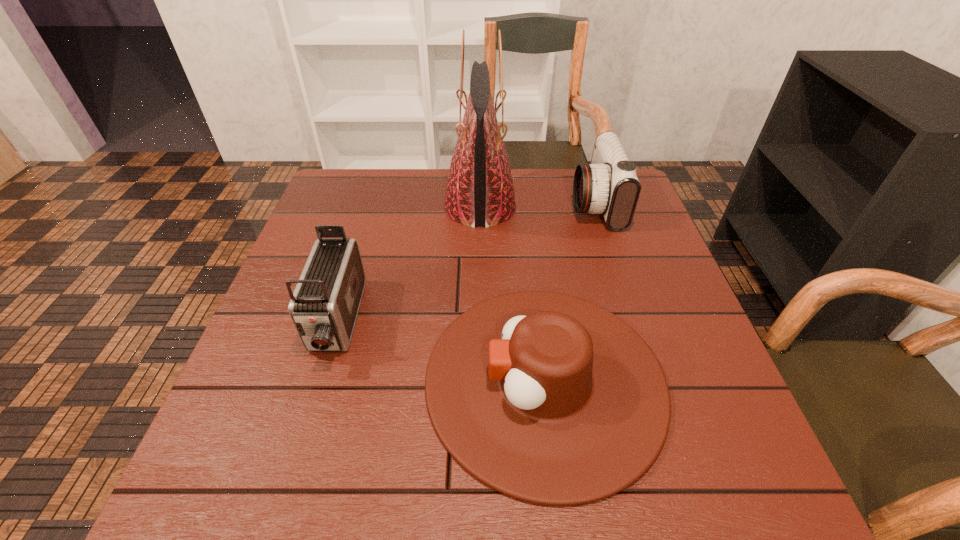
Identify the location of handbag. Image resolution: width=960 pixels, height=540 pixels. (479, 191).

I want to click on the left camcorder, so click(324, 306).

Identify the location of the nearer camcorder. point(324,306).

This screenshot has height=540, width=960. What are the coordinates of `the right camcorder` in the screenshot? It's located at (609, 185).

In order to click on cowboy hat in this screenshot , I will do `click(548, 398)`.

This screenshot has width=960, height=540. Find the location of `vacant space situated on the left of the handbag`. vacant space situated on the left of the handbag is located at coordinates (401, 208).

Find the location of a particular element. The height and width of the screenshot is (540, 960). vacant space located 0.120m at the lens of the left camcorder is located at coordinates (303, 431).

At what (x,y) coordinates should I click in order to perform the action: click on vacant space located 0.260m on the surface of the right camcorder. Please return your answer as a coordinate pair (x, y). The height and width of the screenshot is (540, 960). Looking at the image, I should click on (480, 204).

Locate an element on the screen. vacant area situated 0.340m on the surface of the right camcorder is located at coordinates (452, 204).

This screenshot has width=960, height=540. In order to click on vacant space located on the surface of the right camcorder in this screenshot , I will do `click(522, 204)`.